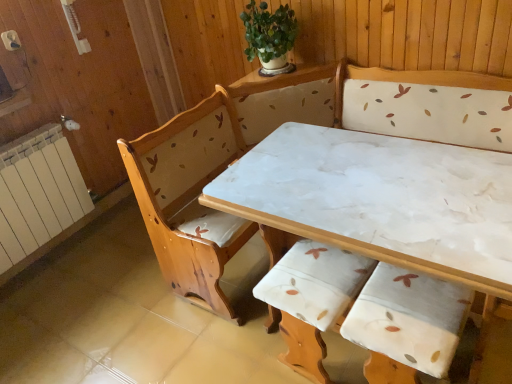
What do you see at coordinates (312, 299) in the screenshot?
I see `wooden armchair with floral upholstery at center` at bounding box center [312, 299].

In the scene shown: Measure the distance between white marble table at center and camera.

white marble table at center and camera are 38.52 inches apart.

At what (x,y) coordinates should I click in order to perform the action: click on green leafy plant at upper center. Please return your answer as a coordinate pair (x, y). This screenshot has width=512, height=384. Looking at the image, I should click on (269, 37).

The height and width of the screenshot is (384, 512). Find the location of `wooden armchair with floral upholstery at center`. wooden armchair with floral upholstery at center is located at coordinates (312, 299).

How different are the orientations of wooden armchair with floral upholstery at center and white marble table at center in degrees?

The facing directions of wooden armchair with floral upholstery at center and white marble table at center are 87.3 degrees apart.

Is point (316, 365) in front of point (296, 142)?

Yes, point (316, 365) is closer to viewer.

From the image's perspective, is wooden armchair with floral upholstery at center below white marble table at center?

Yes, from the image's perspective, wooden armchair with floral upholstery at center is beneath white marble table at center.

Considering the sizes of objects wooden armchair with floral upholstery at center and white marble table at center in the image provided, who is smaller, wooden armchair with floral upholstery at center or white marble table at center?

Smaller between the two is wooden armchair with floral upholstery at center.

From the image's perspective, is white marble table at center located beneath white painted radiator at left?

Yes.

Which is closer to the camera, (371, 203) or (83, 203)?

The point (371, 203) is closer to the camera.

From a real-world perspective, relative to white painted radiator at left, is white marble table at center vertically above or below?

white marble table at center is below white painted radiator at left.

Where is `table located underneath the white painted radiator at left (from a real-world perspective)`? table located underneath the white painted radiator at left (from a real-world perspective) is located at coordinates (x=382, y=200).

In the image, is white marble table at center positioned in front of or behind green leafy plant at upper center?

white marble table at center is positioned closer to the viewer than green leafy plant at upper center.

From the picture: Based on their positions, is white marble table at center located to the left or right of green leafy plant at upper center?

In the image, white marble table at center appears on the right side of green leafy plant at upper center.

From the image's perspective, is white marble table at center positioned above or below green leafy plant at upper center?

From the image's perspective, white marble table at center appears below green leafy plant at upper center.

Measure the distance from white marble table at center to green leafy plant at upper center.

33.85 inches.

Which is in front, point (321, 277) or point (62, 210)?

The point (321, 277) is closer to the camera.

In order to click on radiator above the wooden armchair with floral upholstery at center (from the image's perspective) in this screenshot , I will do `click(40, 189)`.

From a real-world perspective, is wooden armchair with floral upholstery at center physically located above or below white painted radiator at left?

wooden armchair with floral upholstery at center is situated lower than white painted radiator at left in the real world.

Considering the positions of point (275, 56) and point (22, 169), is point (275, 56) closer or farther from the camera than point (22, 169)?

Clearly, point (275, 56) is closer to the camera than point (22, 169).

From a real-world perspective, relative to white painted radiator at left, is green leafy plant at upper center vertically above or below?

Clearly, from a real-world perspective, green leafy plant at upper center is above white painted radiator at left.

From the image's perspective, would you say green leafy plant at upper center is positioned over white painted radiator at left?

Yes, from the image's perspective, green leafy plant at upper center is over white painted radiator at left.

Is green leafy plant at upper center inside or outside of white painted radiator at left?

green leafy plant at upper center is not inside white painted radiator at left, it's outside.

Looking at their sizes, would you say white painted radiator at left is wider or thinner than white marble table at center?

Clearly, white painted radiator at left has less width compared to white marble table at center.

Is white painted radiator at left oriented towards white marble table at center?

Yes, white painted radiator at left faces towards white marble table at center.

Based on the photo, choose the correct answer: Is white painted radiator at left inside green leafy plant at upper center or outside it?

white painted radiator at left cannot be found inside green leafy plant at upper center.

From a real-world perspective, is white painted radiator at left under green leafy plant at upper center?

Indeed, from a real-world perspective, white painted radiator at left is positioned beneath green leafy plant at upper center.

Is white painted radiator at left wider than green leafy plant at upper center?

In fact, white painted radiator at left might be narrower than green leafy plant at upper center.

At what (x,y) coordinates should I click in order to perform the action: click on radiator on the left of green leafy plant at upper center. Please return your answer as a coordinate pair (x, y). Looking at the image, I should click on (40, 189).

Find the location of `armchair located underneath the white marble table at center (from a real-world perspective)`. armchair located underneath the white marble table at center (from a real-world perspective) is located at coordinates (312, 299).

I want to click on radiator above the white marble table at center (from a real-world perspective), so click(40, 189).

Estimate the real-world distances between objects in this image. Which object is further from white marble table at center, wooden armchair with floral upholstery at center or white painted radiator at left?

Among the two, white painted radiator at left is located further to white marble table at center.

When comparing their distances from wooden armchair with floral upholstery at center, does green leafy plant at upper center or white painted radiator at left seem further?

white painted radiator at left is further to wooden armchair with floral upholstery at center.

Which object lies further to the anchor point green leafy plant at upper center, wooden armchair with floral upholstery at center or white marble table at center?

Among the two, wooden armchair with floral upholstery at center is located further to green leafy plant at upper center.

Which object lies nearer to the anchor point wooden armchair with floral upholstery at center, white painted radiator at left or white marble table at center?

The object closer to wooden armchair with floral upholstery at center is white marble table at center.

From the picture: Based on their spatial positions, is white marble table at center or white painted radiator at left further from green leafy plant at upper center?

Based on the image, white painted radiator at left appears to be further to green leafy plant at upper center.

Estimate the real-world distances between objects in this image. Which object is closer to white painted radiator at left, white marble table at center or wooden armchair with floral upholstery at center?

white marble table at center is closer to white painted radiator at left.

Looking at the image, which one is located further to green leafy plant at upper center, white marble table at center or wooden armchair with floral upholstery at center?

wooden armchair with floral upholstery at center is positioned further to the anchor green leafy plant at upper center.

Based on their spatial positions, is wooden armchair with floral upholstery at center or green leafy plant at upper center closer to white marble table at center?

Among the two, wooden armchair with floral upholstery at center is located nearer to white marble table at center.

Image resolution: width=512 pixels, height=384 pixels. I want to click on armchair situated between white painted radiator at left and white marble table at center from left to right, so click(x=312, y=299).

At what (x,y) coordinates should I click in order to perform the action: click on houseplant located between white painted radiator at left and white marble table at center in the left-right direction. Please return your answer as a coordinate pair (x, y). This screenshot has height=384, width=512. Looking at the image, I should click on (269, 37).

The width and height of the screenshot is (512, 384). In order to click on houseplant between white painted radiator at left and wooden armchair with floral upholstery at center in this screenshot , I will do `click(269, 37)`.

The height and width of the screenshot is (384, 512). In order to click on table between green leafy plant at upper center and wooden armchair with floral upholstery at center vertically in this screenshot , I will do `click(382, 200)`.